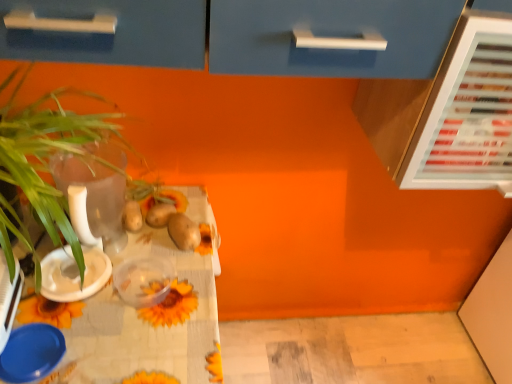
Question: Considering the relative positions of blue plastic bowl at lower left and translucent plastic container at center, which is the second tableware from top to bottom, in the image provided, is blue plastic bowl at lower left to the left of translucent plastic container at center, which is the second tableware from top to bottom, from the viewer's perspective?

Choices:
 (A) no
 (B) yes

Answer: (B)

Question: Is blue plastic bowl at lower left taller than translucent plastic container at center, which is the second tableware from top to bottom?

Choices:
 (A) no
 (B) yes

Answer: (B)

Question: Does blue plastic bowl at lower left have a lesser width compared to translucent plastic container at center, which is the second tableware from top to bottom?

Choices:
 (A) no
 (B) yes

Answer: (A)

Question: Would you say blue plastic bowl at lower left is outside translucent plastic container at center, which is the second tableware from top to bottom?

Choices:
 (A) yes
 (B) no

Answer: (A)

Question: From a real-world perspective, is blue plastic bowl at lower left positioned under translucent plastic container at center, arranged as the 2th tableware when ordered from the bottom, based on gravity?

Choices:
 (A) no
 (B) yes

Answer: (A)

Question: Is blue plastic lid at lower left, positioned as the 3th tableware in top-to-bottom order, inside the boundaries of yellow matte flower at center, or outside?

Choices:
 (A) inside
 (B) outside

Answer: (B)

Question: Visually, is blue plastic lid at lower left, which is the 1th tableware in bottom-to-top order, positioned to the left or to the right of yellow matte flower at center?

Choices:
 (A) left
 (B) right

Answer: (A)

Question: In terms of height, does blue plastic lid at lower left, which is the 1th tableware in bottom-to-top order, look taller or shorter compared to yellow matte flower at center?

Choices:
 (A) short
 (B) tall

Answer: (A)

Question: In terms of size, does blue plastic lid at lower left, which is the 1th tableware in bottom-to-top order, appear bigger or smaller than yellow matte flower at center?

Choices:
 (A) small
 (B) big

Answer: (B)

Question: Relative to green leafy plant at left, is white plastic bowl at left, which is counted as the 3th tableware, starting from the bottom, in front or behind?

Choices:
 (A) front
 (B) behind

Answer: (B)

Question: Based on their sizes in the image, would you say white plastic bowl at left, the first tableware from the top, is bigger or smaller than green leafy plant at left?

Choices:
 (A) big
 (B) small

Answer: (B)

Question: From a real-world perspective, is white plastic bowl at left, the first tableware from the top, physically located above or below green leafy plant at left?

Choices:
 (A) above
 (B) below

Answer: (B)

Question: In the image, is white plastic bowl at left, which is counted as the 3th tableware, starting from the bottom, on the left side or the right side of green leafy plant at left?

Choices:
 (A) right
 (B) left

Answer: (B)

Question: Is yellow matte flower at center in front of or behind white plastic bowl at left, which is counted as the 3th tableware, starting from the bottom, in the image?

Choices:
 (A) front
 (B) behind

Answer: (B)

Question: Is yellow matte flower at center taller or shorter than white plastic bowl at left, the first tableware from the top?

Choices:
 (A) tall
 (B) short

Answer: (A)